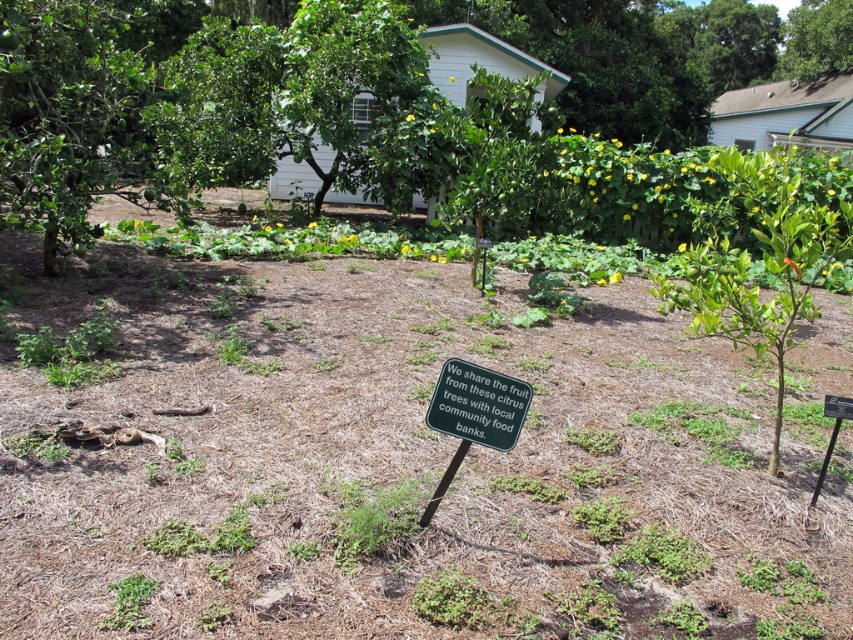
Is green leafy tree at center taller than green leafy tree at upper right?

Indeed, green leafy tree at center has a greater height compared to green leafy tree at upper right.

Is green leafy tree at center positioned at the back of green leafy tree at upper right?

No, it is in front of green leafy tree at upper right.

Which is in front, point (47, 38) or point (809, 24)?

Positioned in front is point (47, 38).

The height and width of the screenshot is (640, 853). Identify the location of green leafy tree at center. (340, 118).

Who is lower down, green leafy tree at upper center or green leafy tree at upper right?

green leafy tree at upper center is below.

Who is more forward, (323, 52) or (788, 49)?

Point (323, 52)

You are a GUI agent. You are given a task and a screenshot of the screen. Output one action in this format:
    pyautogui.click(x=<x>, y=<y>)
    Task: Click on the green leafy tree at upper center
    This screenshot has height=640, width=853.
    Given the screenshot: What is the action you would take?
    pyautogui.click(x=358, y=100)

Who is taller, green leafy tree at center or green plastic sign at center?

green leafy tree at center is taller.

Is green leafy tree at center wider than green plastic sign at center?

Indeed, green leafy tree at center has a greater width compared to green plastic sign at center.

Who is more forward, (614, 104) or (518, 433)?

Positioned in front is point (518, 433).

Identify the location of green leafy tree at center. (340, 118).